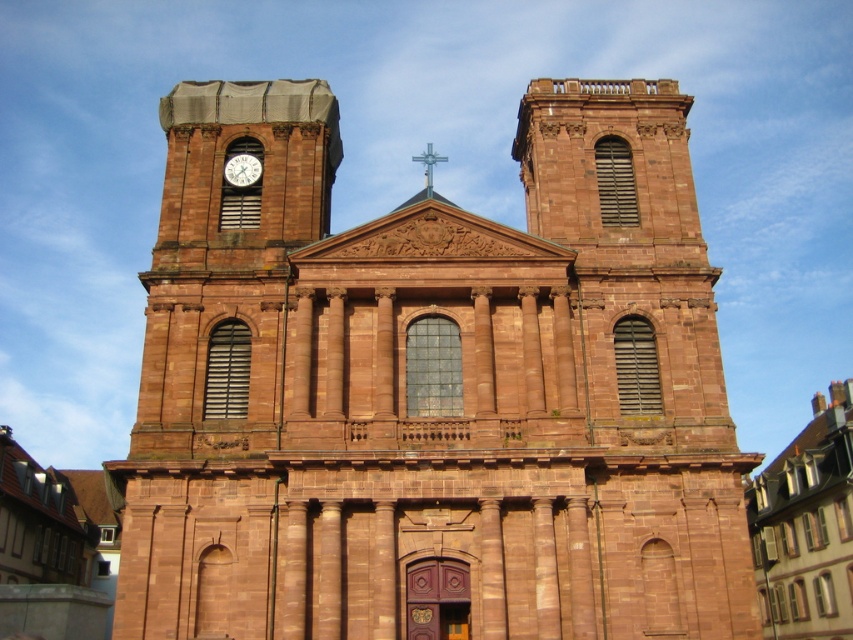
Consider the image. You are an architect visiting the historic church. You notice the brown stone church at center and the white glossy clock at upper left. Which object would cast a longer shadow during midday when the sun is directly overhead?

The brown stone church at center is larger in size than the white glossy clock at upper left, so it would cast a longer shadow during midday when the sun is directly overhead.